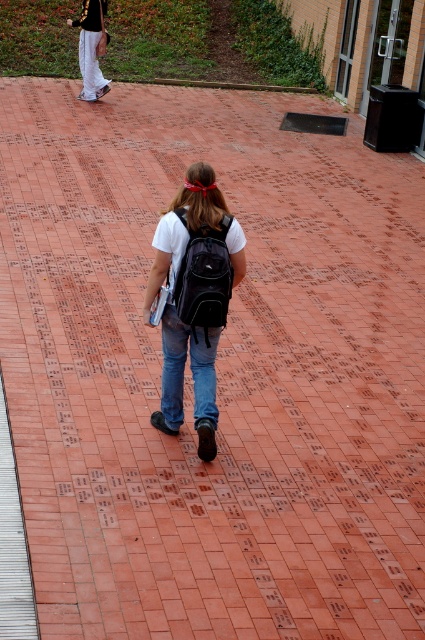
Question: Which object is closer to the camera taking this photo?

Choices:
 (A) denim at center
 (B) black fabric backpack at center

Answer: (B)

Question: Does matte black backpack at center have a larger size compared to black fabric backpack at center?

Choices:
 (A) yes
 (B) no

Answer: (A)

Question: Observing the image, what is the correct spatial positioning of black fabric backpack at center in reference to denim at center?

Choices:
 (A) left
 (B) right

Answer: (B)

Question: Which object is the farthest from the matte black backpack at center?

Choices:
 (A) black fabric backpack at center
 (B) denim at center

Answer: (B)

Question: Is matte black backpack at center to the left of denim at center from the viewer's perspective?

Choices:
 (A) yes
 (B) no

Answer: (A)

Question: Based on their relative distances, which object is nearer to the denim at center?

Choices:
 (A) black fabric backpack at center
 (B) matte black backpack at center

Answer: (B)